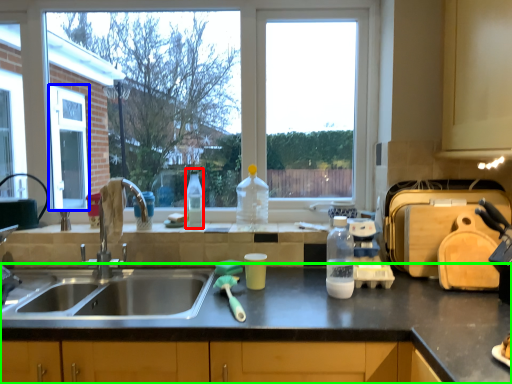
Question: Which object is the farthest from bottle (highlighted by a red box)? Choose among these: screen door (highlighted by a blue box) or countertop (highlighted by a green box).

Choices:
 (A) screen door
 (B) countertop

Answer: (A)